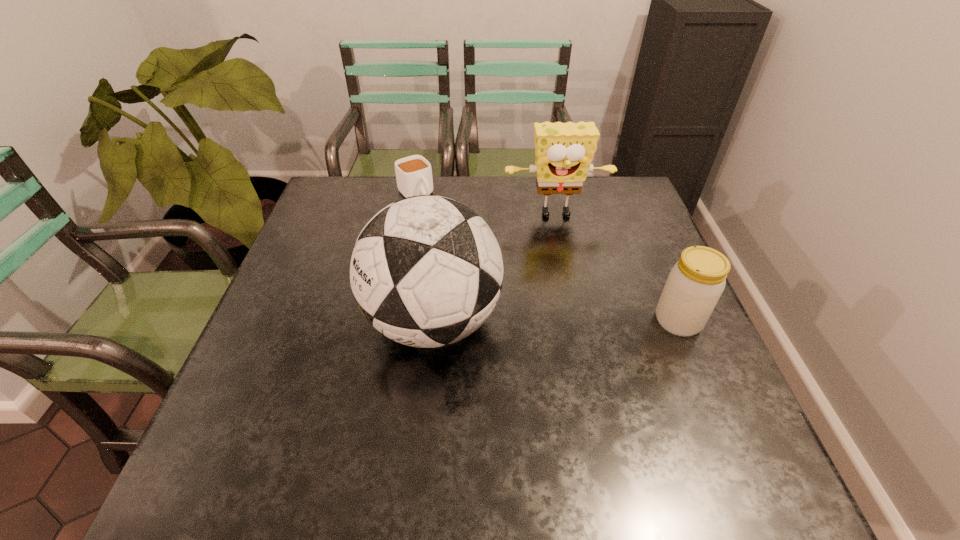
Locate an element on the screen. The image size is (960, 540). object that is at the far right corner is located at coordinates (564, 151).

In the image, there is a desktop. Where is `free region at the near edge`? free region at the near edge is located at coordinates (369, 416).

In the image, there is a desktop. Identify the location of vacant space at the left edge. Image resolution: width=960 pixels, height=540 pixels. (276, 347).

Where is `blank area at the right edge`? blank area at the right edge is located at coordinates (698, 378).

Image resolution: width=960 pixels, height=540 pixels. Identify the location of vacant space at the far left corner of the desktop. tap(356, 192).

In the image, there is a desktop. At what (x,y) coordinates should I click in order to perform the action: click on vacant space at the far right corner. Please return your answer as a coordinate pair (x, y). Looking at the image, I should click on (613, 212).

The image size is (960, 540). Identify the location of free space at the near right corner of the desktop. (717, 401).

Where is `free space between the second tallest object and the jar`? This screenshot has width=960, height=540. free space between the second tallest object and the jar is located at coordinates (617, 268).

Locate an element on the screen. free space between the shortest object and the second shortest object is located at coordinates (546, 258).

Where is `the second closest object to the third tallest object`? the second closest object to the third tallest object is located at coordinates (426, 271).